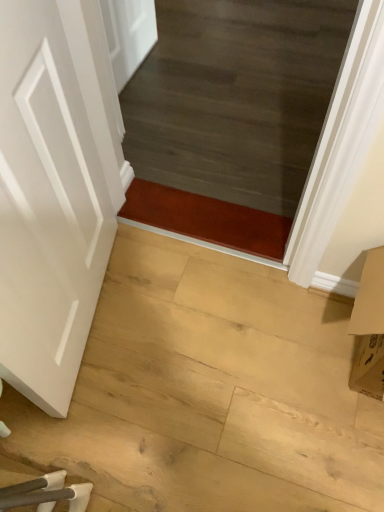
What is the approximate width of transparent glass door at upper center?

transparent glass door at upper center is 2.78 inches in width.

What do you see at coordinates (231, 116) in the screenshot? This screenshot has height=512, width=384. I see `transparent glass door at upper center` at bounding box center [231, 116].

Image resolution: width=384 pixels, height=512 pixels. I want to click on transparent glass door at upper center, so coord(231,116).

Locate an element on the screen. The image size is (384, 512). transparent glass door at upper center is located at coordinates (231, 116).